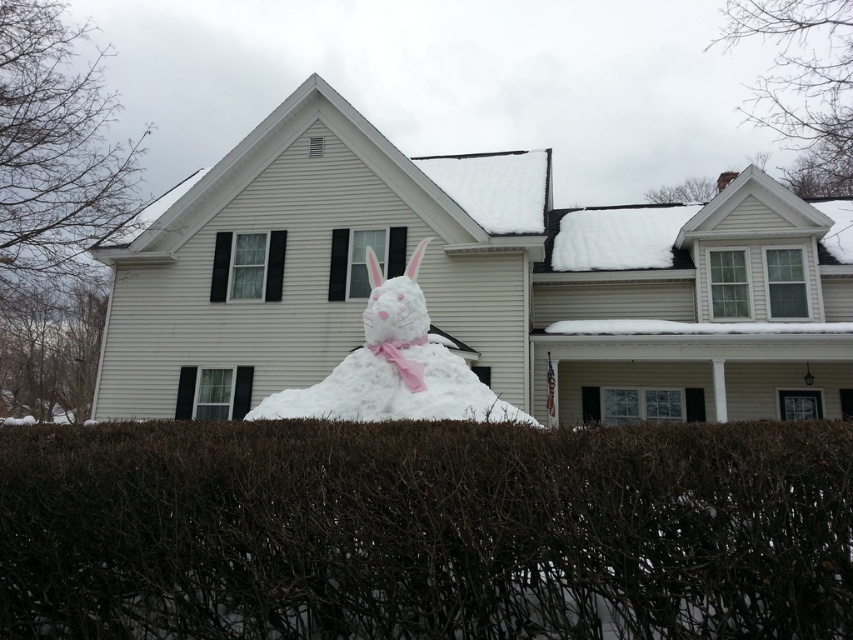
Question: Is brown textured hedge at lower center positioned at the back of white fluffy snowman at center?

Choices:
 (A) no
 (B) yes

Answer: (A)

Question: Is brown textured hedge at lower center behind white fluffy snowman at center?

Choices:
 (A) no
 (B) yes

Answer: (A)

Question: Among these objects, which one is farthest from the camera?

Choices:
 (A) white fluffy snowman at center
 (B) brown textured hedge at lower center

Answer: (A)

Question: Which object appears closest to the camera in this image?

Choices:
 (A) white fluffy snowman at center
 (B) brown textured hedge at lower center

Answer: (B)

Question: Does brown textured hedge at lower center appear on the right side of white fluffy snowman at center?

Choices:
 (A) yes
 (B) no

Answer: (A)